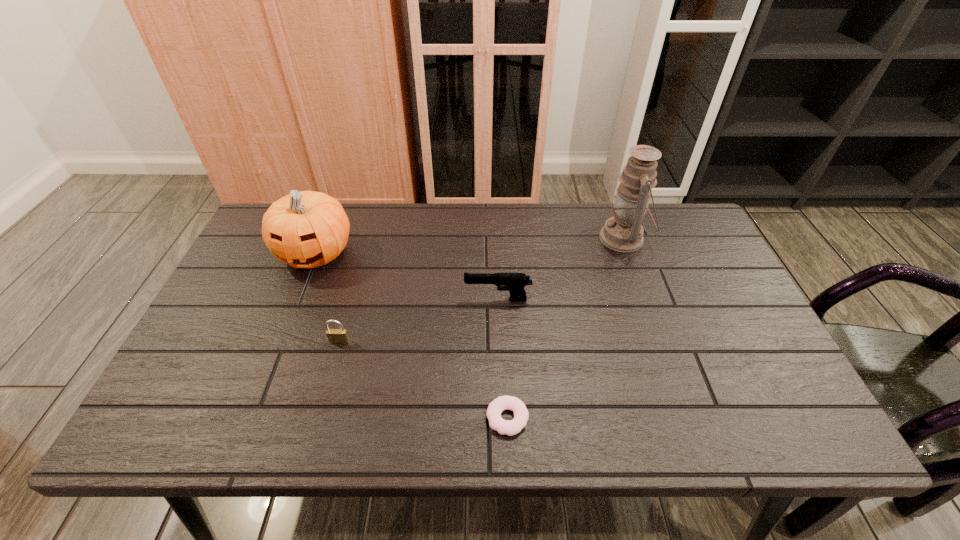
Where is `object that is at the left edge`? object that is at the left edge is located at coordinates (306, 229).

At what (x,y) coordinates should I click in order to perform the action: click on object at the far left corner. Please return your answer as a coordinate pair (x, y). This screenshot has width=960, height=540. Looking at the image, I should click on (306, 229).

You are a GUI agent. You are given a task and a screenshot of the screen. Output one action in this format:
    pyautogui.click(x=<x>, y=<y>)
    Task: Click on the free space at the far edge of the desktop
    The height and width of the screenshot is (540, 960).
    Given the screenshot: What is the action you would take?
    pyautogui.click(x=348, y=211)

Where is `vacant space at the near edge of the desktop`? The height and width of the screenshot is (540, 960). vacant space at the near edge of the desktop is located at coordinates (676, 405).

Find the location of a particular element. free space at the left edge of the desktop is located at coordinates (253, 266).

I want to click on free location at the right edge, so click(692, 257).

Identify the location of vacant space at the near right corner. The height and width of the screenshot is (540, 960). (772, 417).

Where is `free space between the nearest object and the tallest object`? The height and width of the screenshot is (540, 960). free space between the nearest object and the tallest object is located at coordinates (565, 328).

This screenshot has width=960, height=540. What are the coordinates of `empty location between the rightmost object and the second nearest object` in the screenshot? It's located at (482, 290).

This screenshot has width=960, height=540. I want to click on vacant region between the doughnut and the tallest object, so click(x=565, y=328).